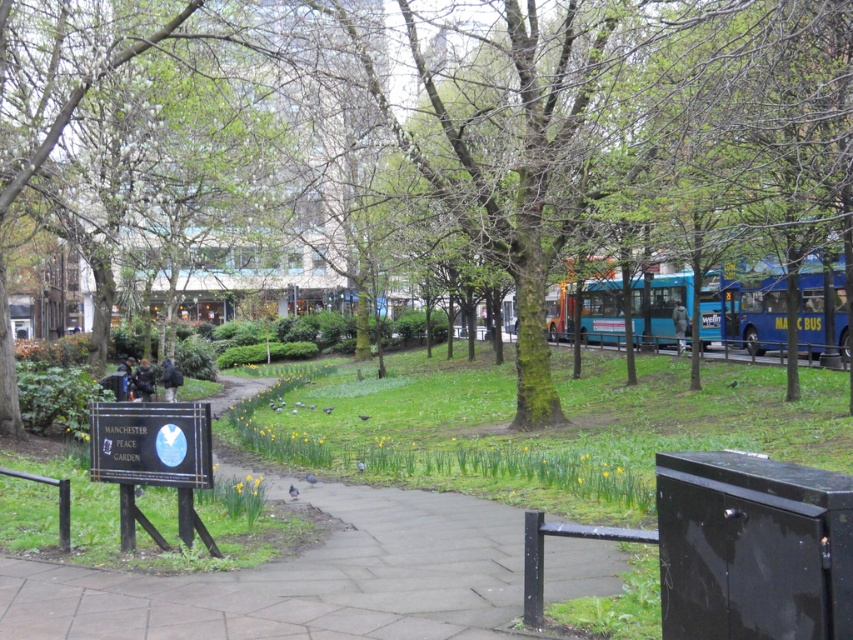
You are a pedestrian standing on the pathway in the park and see two blue metallic buses. Which one is wider? The blue metallic bus at right or the blue metallic bus at center?

The blue metallic bus at center is wider than the blue metallic bus at right.

You are standing at the entrance of the park and see two points marked in the scene. Which point is closer to you, point (x=601, y=70) or point (x=202, y=444)?

Point (x=601, y=70) is closer to you because it is further to the viewer than point (x=202, y=444).

You are standing at the entrance of the park and want to reach the green mossy tree at center. The path is 10 meters long. Can you walk straight ahead without needing to turn?

The distance between you and the green mossy tree at center is 9.01 meters, which is shorter than the 10 meter path length. Therefore, walking straight ahead will allow you to reach the tree without needing to turn.